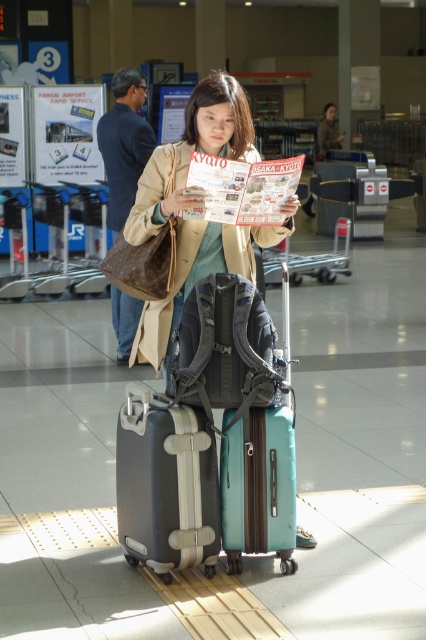
You are a luggage attendant at the airport. You need to check if there is enough space between the matte beige coat at center and the teal matte suitcase at center to place a 3.5 feet long strap. Can you fit it?

The distance between the matte beige coat at center and the teal matte suitcase at center is 4.30 feet. Since the strap is 3.5 feet long, it can fit comfortably between them as there is enough space.

You are an airport staff member assisting a traveler who is trying to determine if their matte beige coat at center can fit into the overhead compartment with their matte black suitcase at center. Based on the size comparison between the two items, which one is more likely to fit in the overhead compartment?

The matte black suitcase at center is more likely to fit in the overhead compartment because it is smaller in size compared to the matte beige coat at center.

You are a traveler standing at the airport terminal. You see a point marked at coordinates [190,152]. What object is located at this point?

The point at coordinates [190,152] indicates the matte beige coat at center.